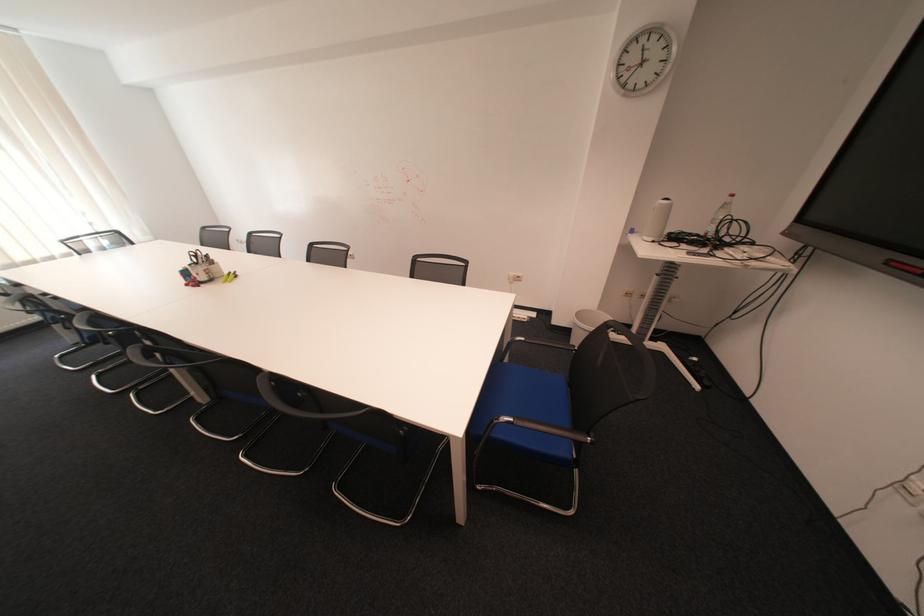
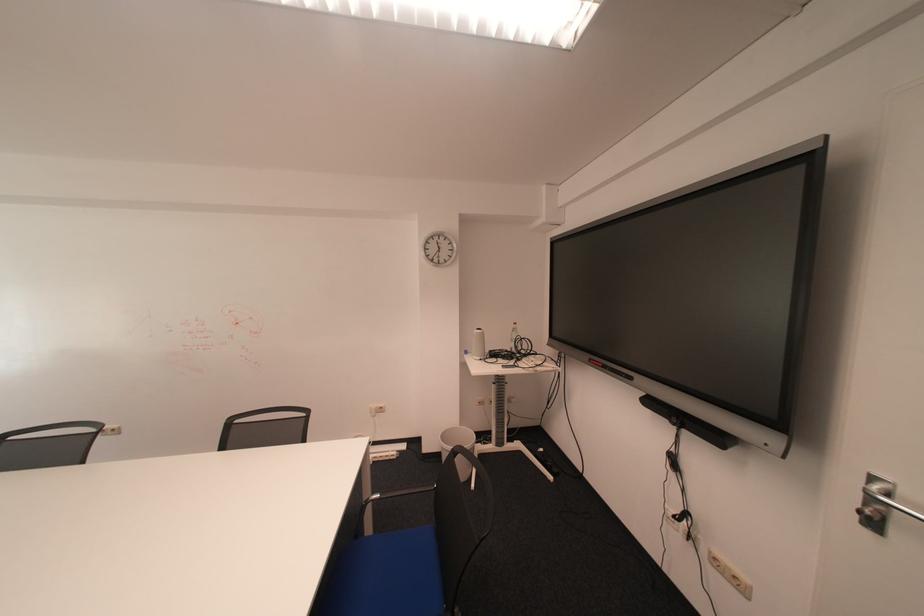
Find the pixel in the second image that matches the point at 590,315 in the first image.

(456, 437)